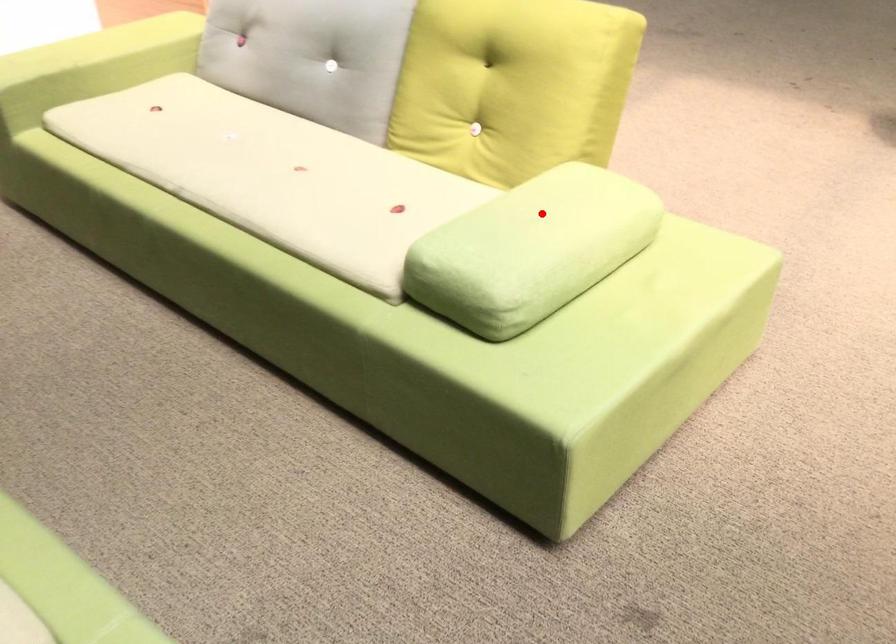
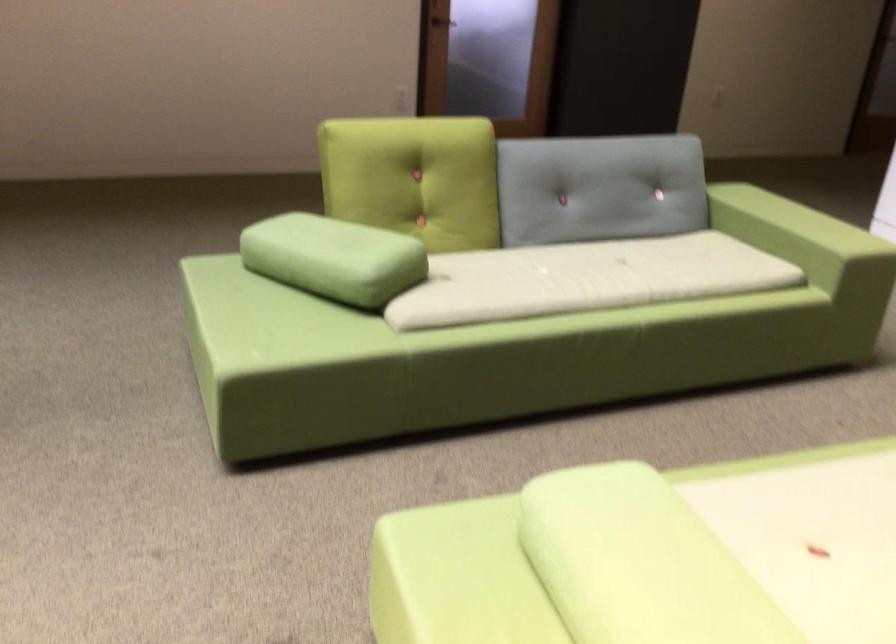
Find the pixel in the second image that matches the highlighted location in the first image.

(651, 556)